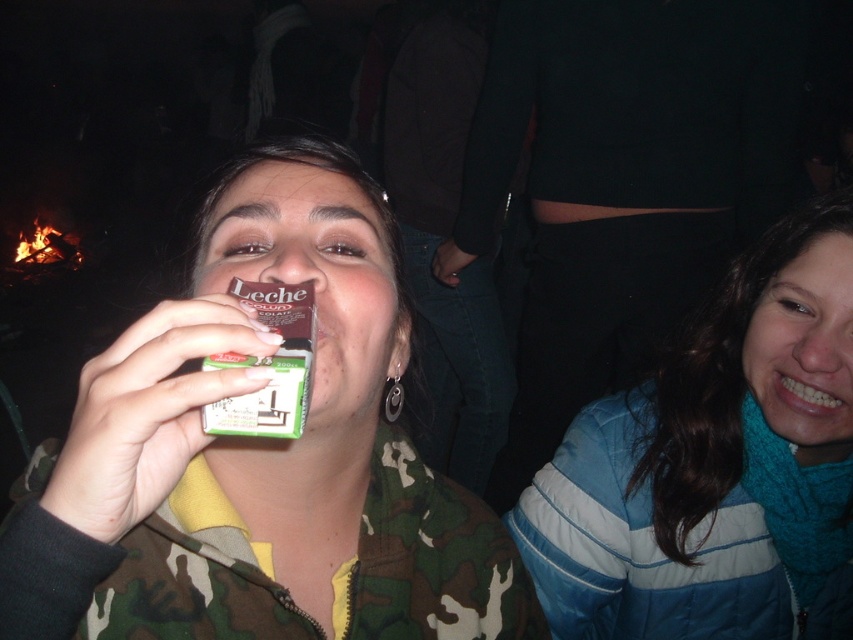
You are at a party and need to decide which jacket to borrow based on size. The camouflage jacket at center and the blue fleece jacket at lower right are available. Which one is bigger?

The blue fleece jacket at lower right is bigger than the camouflage jacket at center.